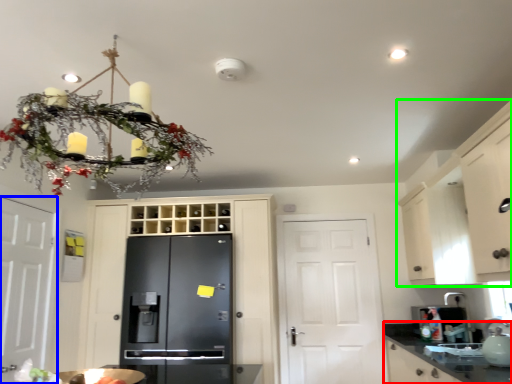
Question: Based on their relative distances, which object is farther from countertop (highlighted by a red box)? Choose from door (highlighted by a blue box) and cabinetry (highlighted by a green box).

Choices:
 (A) door
 (B) cabinetry

Answer: (A)